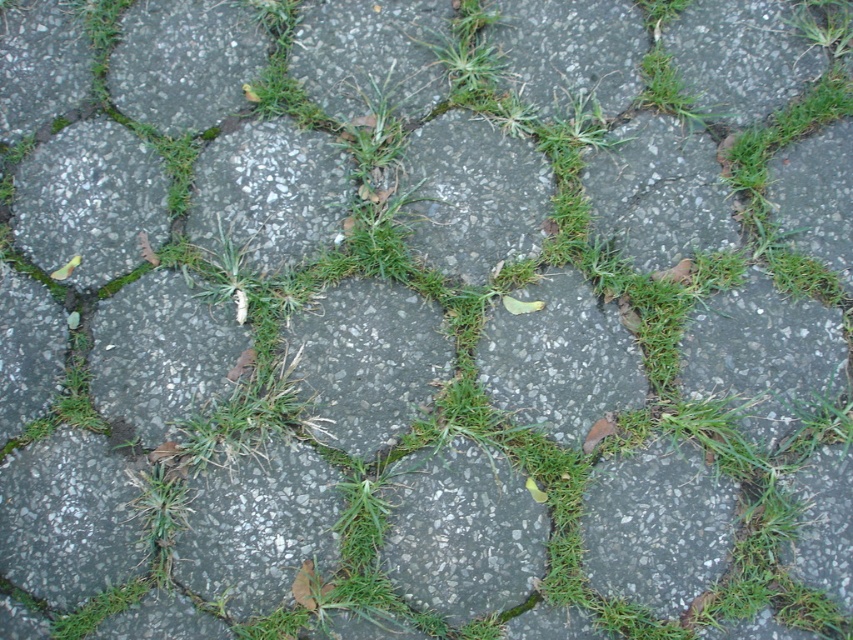
Between point (296, 182) and point (196, 13), which one is positioned behind?

The point (196, 13) is more distant.

Between point (221, 161) and point (123, 58), which one is positioned in front?

Point (221, 161)

The height and width of the screenshot is (640, 853). I want to click on speckled concrete stone at center, so click(270, 192).

Is gray concrete hexagon at upper left taller than gray speckled stone at upper left?

Correct, gray concrete hexagon at upper left is much taller as gray speckled stone at upper left.

Who is positioned more to the left, gray concrete hexagon at upper left or gray speckled stone at upper left?

gray concrete hexagon at upper left is more to the left.

Measure the distance between point (148, 164) and camera.

A distance of 7.07 feet exists between point (148, 164) and camera.

Where is `gray concrete hexagon at upper left`? The width and height of the screenshot is (853, 640). gray concrete hexagon at upper left is located at coordinates [90, 202].

Between gray concrete hexagon at upper left and speckled concrete stone at center, which one is positioned higher?

speckled concrete stone at center is above.

From the picture: Does gray concrete hexagon at upper left have a larger size compared to speckled concrete stone at center?

Yes, gray concrete hexagon at upper left is bigger than speckled concrete stone at center.

Where is `gray concrete hexagon at upper left`? gray concrete hexagon at upper left is located at coordinates (90, 202).